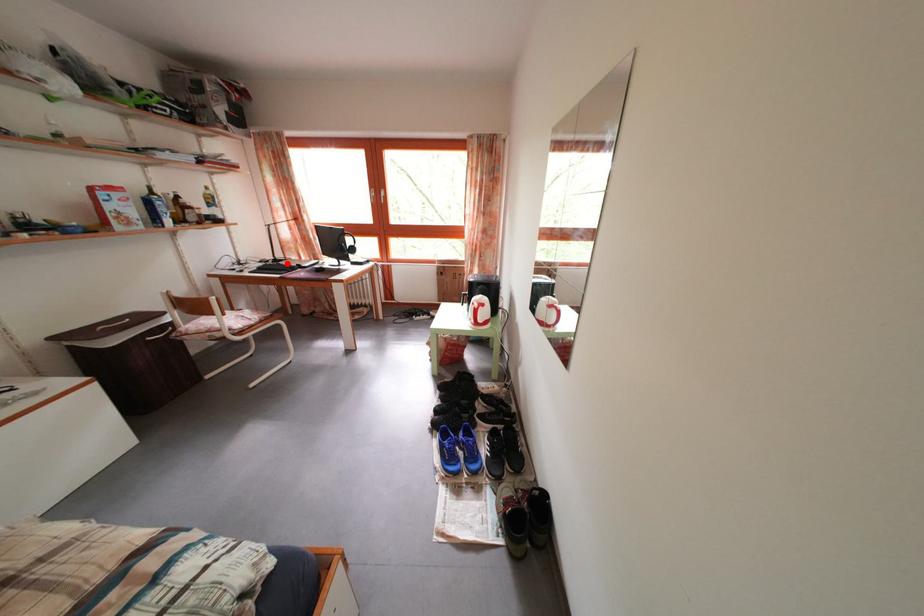
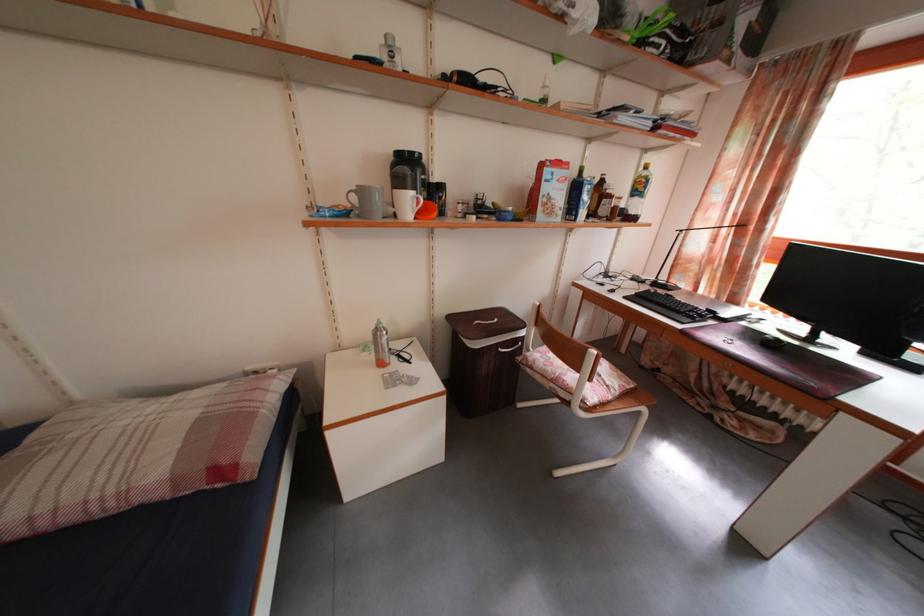
The point at the highlighted location is marked in the first image. Where is the corresponding point in the second image?

(671, 285)